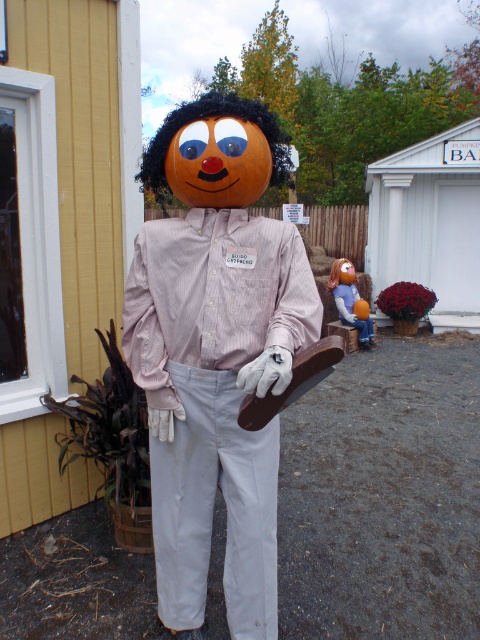
You are standing at the edge of the scene and want to reach both the pink striped shirt at center and the orange matte pumpkin at center. Which object is closer to you?

The pink striped shirt at center is 5.56 meters away from the orange matte pumpkin at center, so whichever is closer depends on your position. However, since both are at center, they are equidistant from the edge.

You are a photographer trying to capture a clear photo of both the pink striped shirt at center and the orange matte pumpkin at center. Since you want both subjects to be in focus, which one should you adjust your camera focus on first?

The pink striped shirt at center is closer to the viewer than the orange matte pumpkin at center, so you should focus on the pink striped shirt at center first to ensure both are in focus.